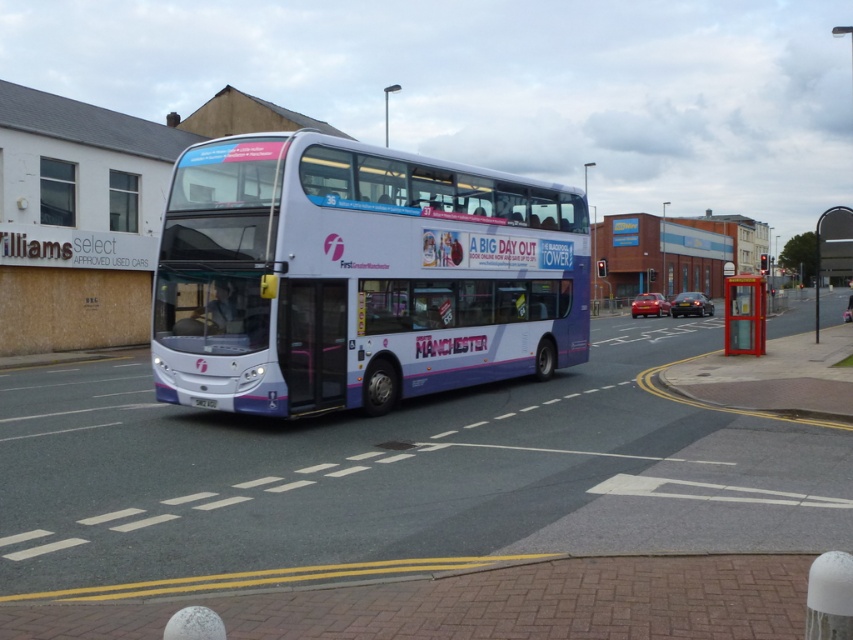
You are a passenger waiting at the metallic bus stop at right. You see the white glossy bus at center approaching. Will the bus be able to stop directly in front of the bus stop?

The white glossy bus at center is below the metallic bus stop at right, meaning it is on a lower level or position. Since buses typically stop at the same level as the bus stop, the bus will need to adjust its position to align with the bus stop before stopping.

You are a pedestrian standing on the sidewalk and want to take a photo of the white glossy bus at center and the white plastic license plate at center. Your camera can focus on objects within 15 feet. Will both objects be in focus?

The white glossy bus at center is 14.11 feet away from the white plastic license plate at center. Since both objects are within the 15 feet focusing range of the camera, they will both be in focus.

Where is the white glossy bus at center located in the image?

The white glossy bus at center is located at point (358, 276).